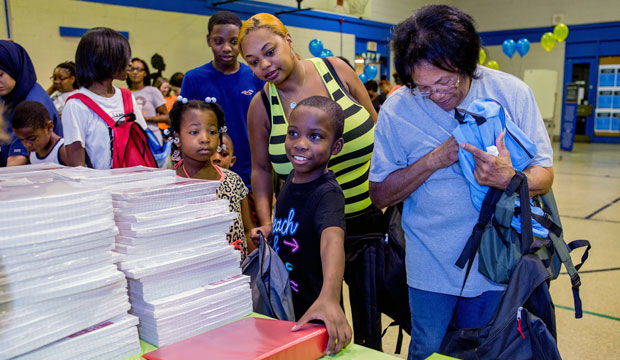
In order to click on binder in this screenshot , I will do pos(284,344).